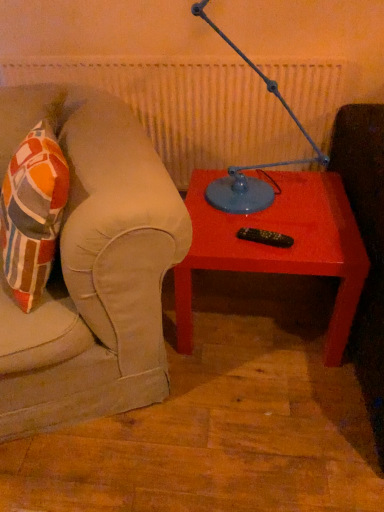
Identify the location of vacant space underneath blue metallic table lamp at upper center (from a real-world perspective). This screenshot has height=512, width=384. (276, 205).